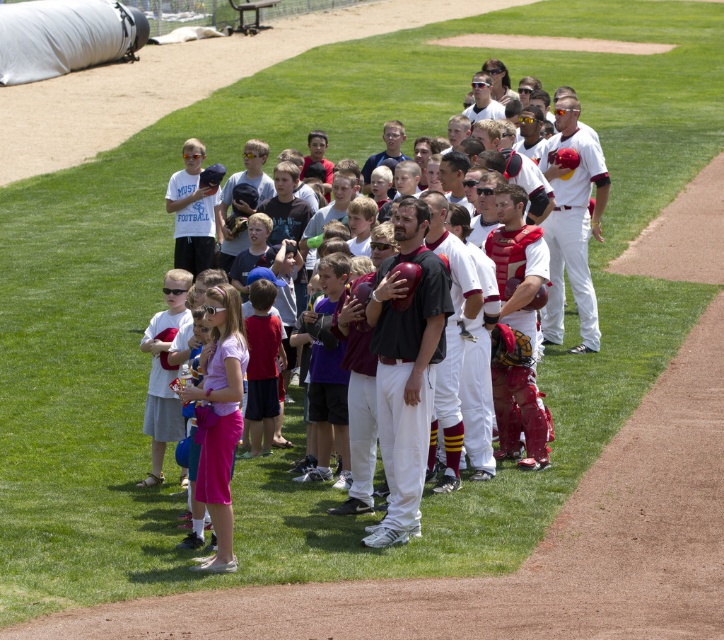
You are standing at the edge of the baseball field and want to take a photo that includes both point (227, 509) and point (439, 292). Which point will appear larger in your photo?

Point (227, 509) will appear larger in the photo because it is closer to the camera than point (439, 292).